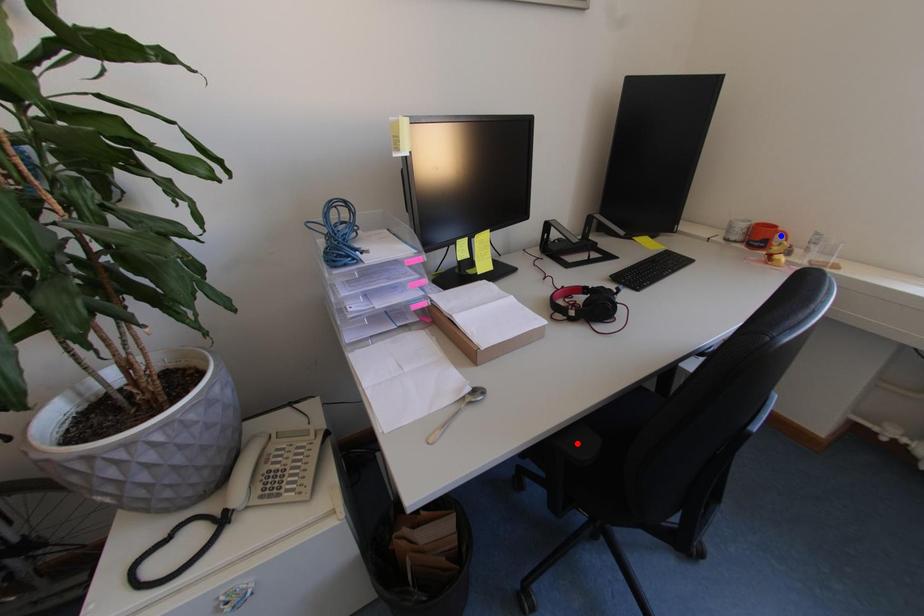
Question: Which of the two points in the image is closer to the camera?

Choices:
 (A) Blue point is closer.
 (B) Red point is closer.

Answer: (B)